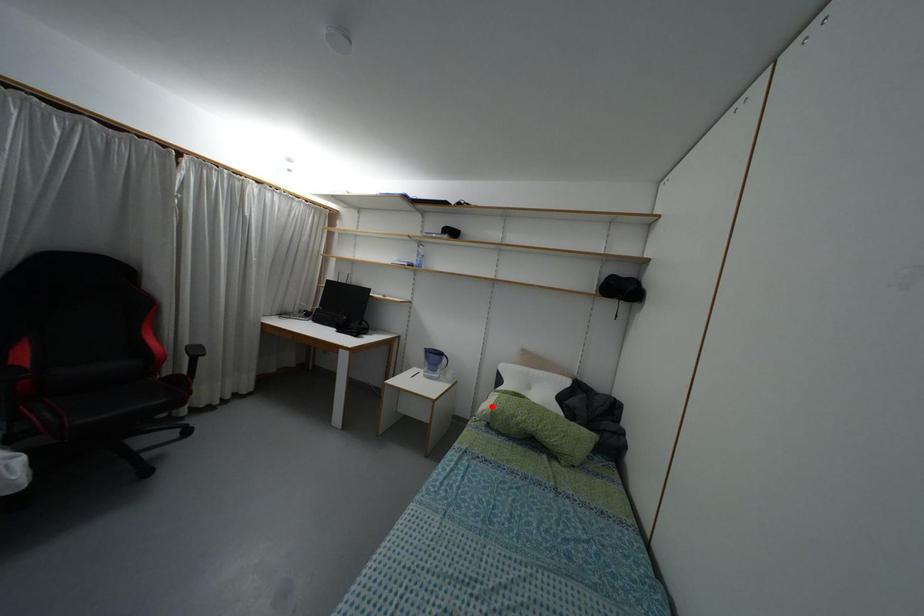
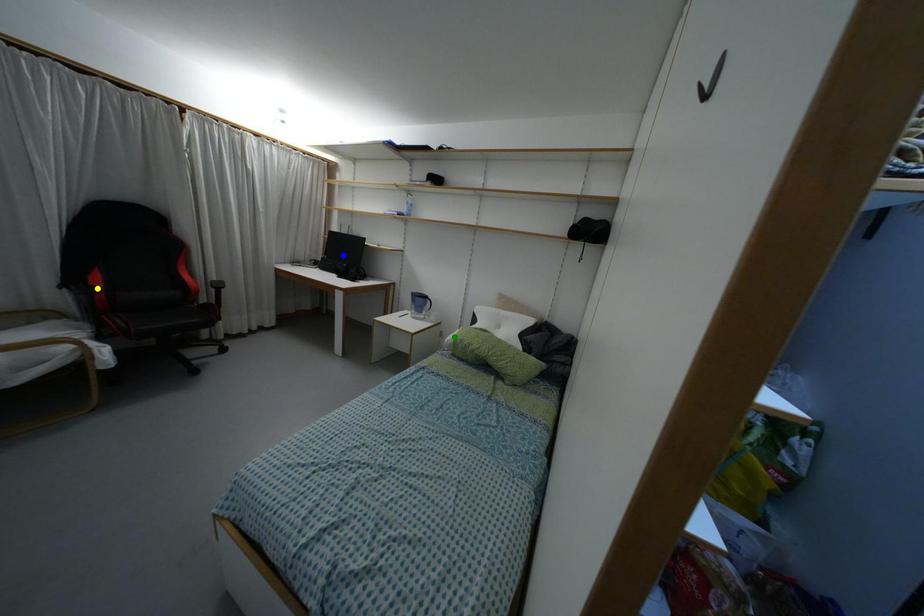
Question: I am providing you with two images of the same scene from different viewpoints. A red point is marked on the first image. You are given multiple points on the second image. In image 2, which mark is for the same physical point as the one in image 1?

Choices:
 (A) yellow point
 (B) blue point
 (C) green point

Answer: (C)